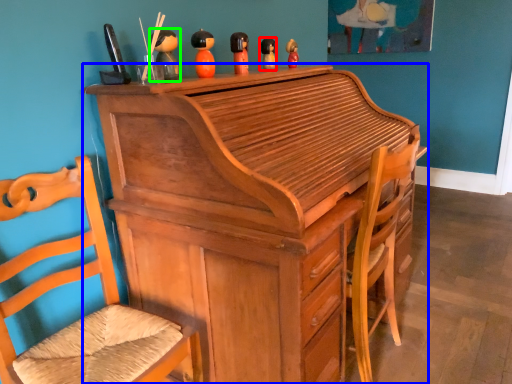
Question: Estimate the real-world distances between objects in this image. Which object is closer to toy (highlighted by a red box), desk (highlighted by a blue box) or toy (highlighted by a green box)?

Choices:
 (A) desk
 (B) toy

Answer: (B)